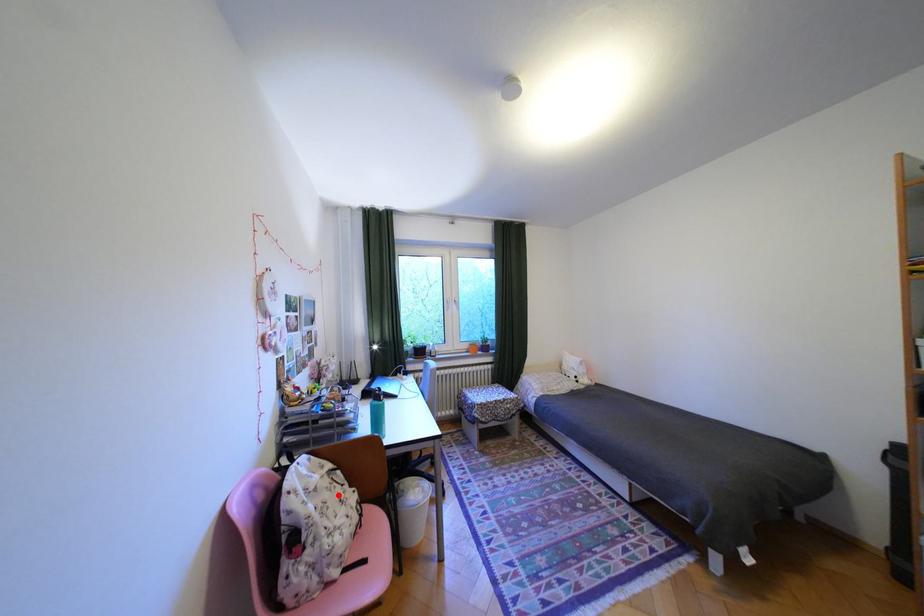
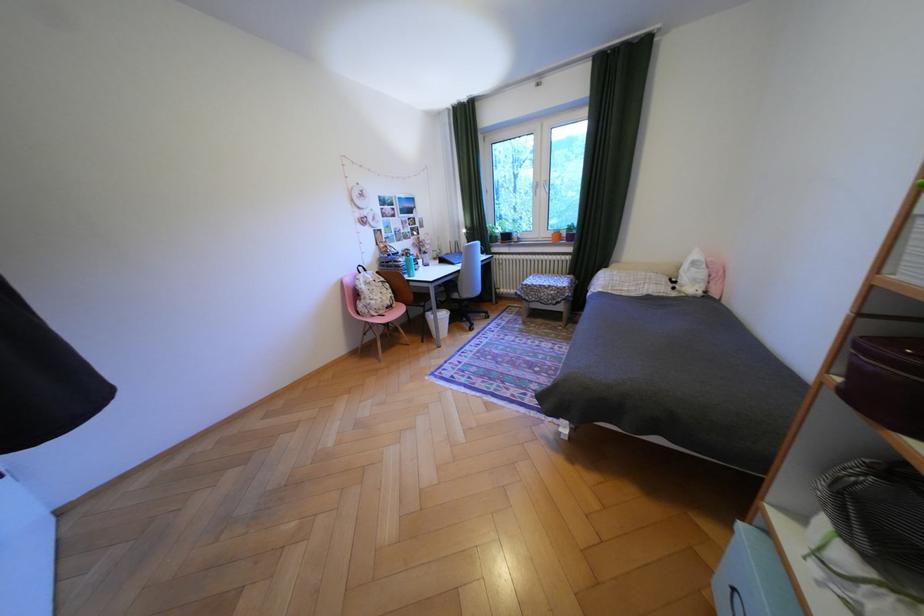
Question: A red point is marked in image1. In image2, is the corresponding 3D point closer to the camera or farther? Reply with the corresponding letter.

Choices:
 (A) The corresponding 3D point is closer.
 (B) The corresponding 3D point is farther.

Answer: (A)